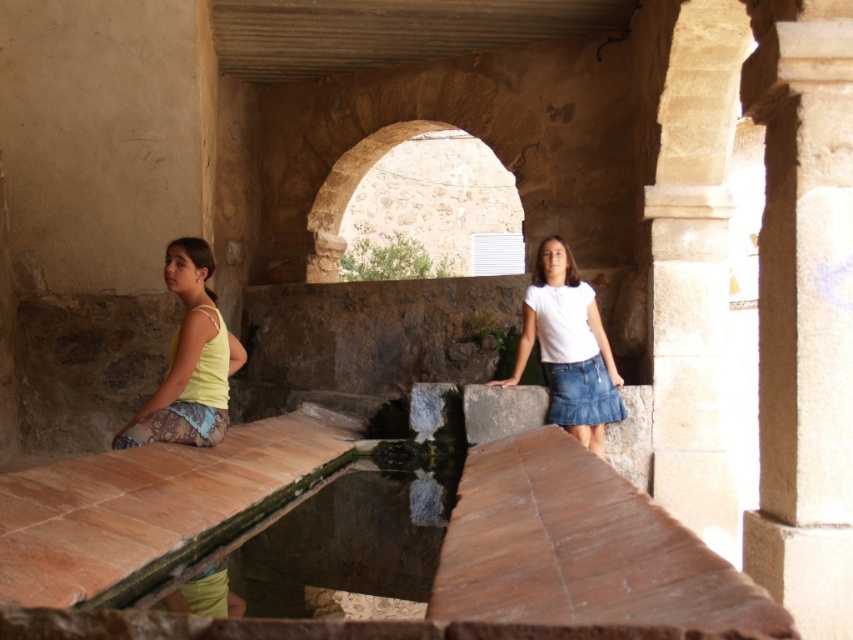
Question: Among these points, which one is farthest from the camera?

Choices:
 (A) (465, 241)
 (B) (593, 344)
 (C) (165, 600)

Answer: (A)

Question: Can you confirm if smooth stone pillar at right is positioned to the left of yellow fabric skirt at left?

Choices:
 (A) yes
 (B) no

Answer: (B)

Question: Estimate the real-world distances between objects in this image. Which object is farther from the white stone pillar at right?

Choices:
 (A) white denim skirt at center
 (B) smooth stone pillar at right
 (C) yellow fabric skirt at left

Answer: (C)

Question: Is white stone pillar at right bigger than smooth stone pillar at right?

Choices:
 (A) yes
 (B) no

Answer: (A)

Question: Which point is farther from the camera taking this photo?

Choices:
 (A) (549, 291)
 (B) (685, 148)
 (C) (134, 428)
 (D) (782, 246)

Answer: (B)

Question: Does yellow fabric skirt at left have a lesser width compared to white denim skirt at center?

Choices:
 (A) yes
 (B) no

Answer: (A)